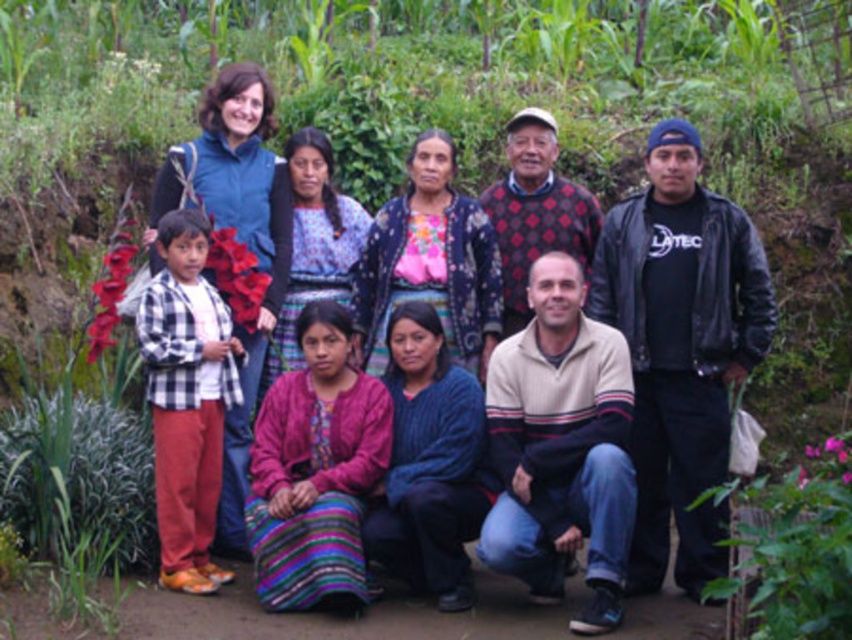
Can you confirm if black leather jacket at right is taller than knitted sweater at center?

No, black leather jacket at right is not taller than knitted sweater at center.

From the picture: Does black leather jacket at right appear on the left side of knitted sweater at center?

Incorrect, black leather jacket at right is not on the left side of knitted sweater at center.

Does point (659, 323) come behind point (538, 125)?

No, (659, 323) is closer to viewer.

I want to click on black leather jacket at right, so click(x=680, y=348).

Is multicolored woven skirt at center wider than black leather jacket at right?

Yes.

Is multicolored woven skirt at center to the left of black leather jacket at right from the viewer's perspective?

Correct, you'll find multicolored woven skirt at center to the left of black leather jacket at right.

Identify the location of multicolored woven skirt at center. (672, 340).

The image size is (852, 640). Find the location of `multicolored woven skirt at center`. multicolored woven skirt at center is located at coordinates point(672,340).

How distant is multicolored woven skirt at center from knitted sweater at center?

The distance of multicolored woven skirt at center from knitted sweater at center is 4.24 feet.

Does point (648, 240) lie behind point (580, 237)?

No, it is not.

Locate an element on the screen. This screenshot has height=640, width=852. multicolored woven skirt at center is located at coordinates (672, 340).